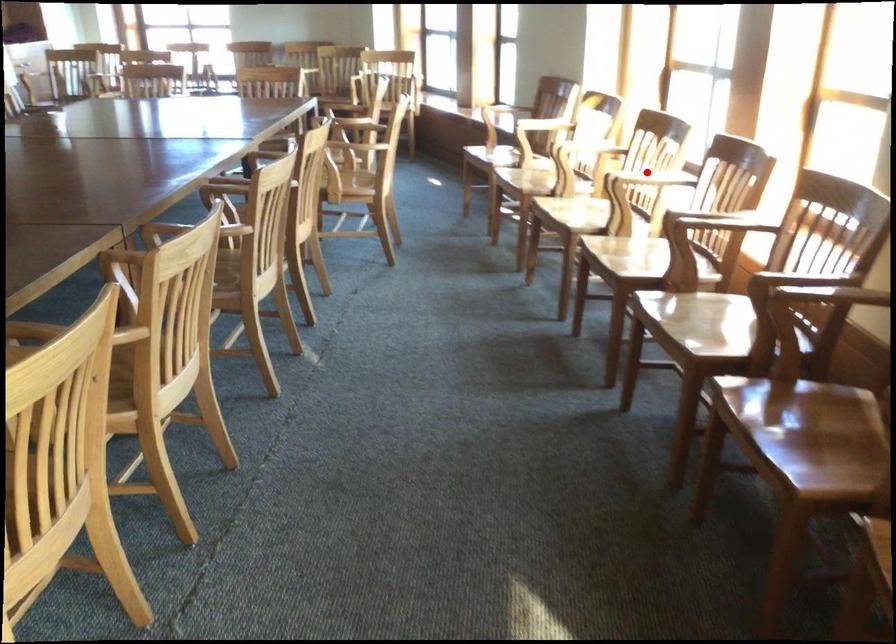
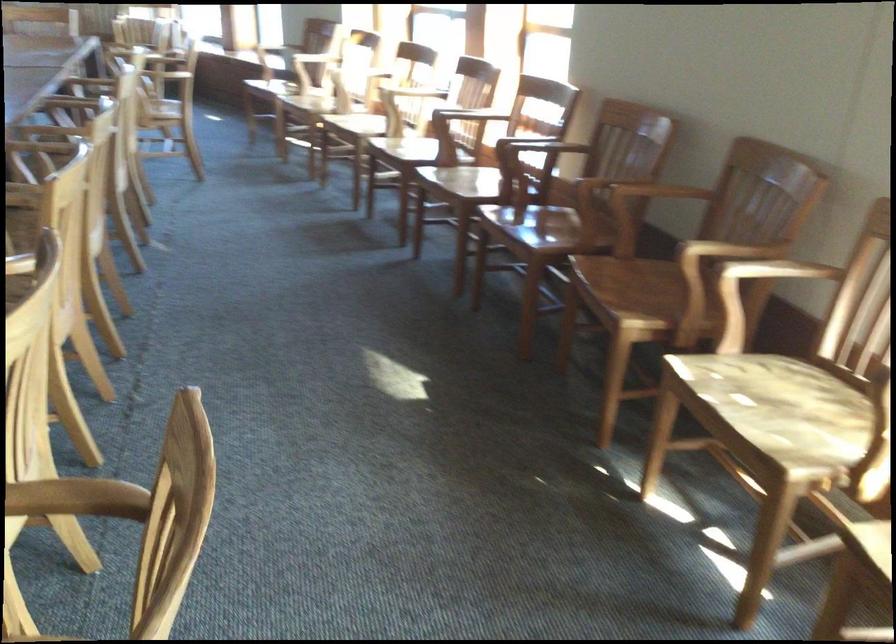
Question: I am providing you with two images of the same scene from different viewpoints. A red point is marked on the first image. At the location where the point appears in image 1, is it still visible in image 2?

Choices:
 (A) Yes
 (B) No

Answer: (A)